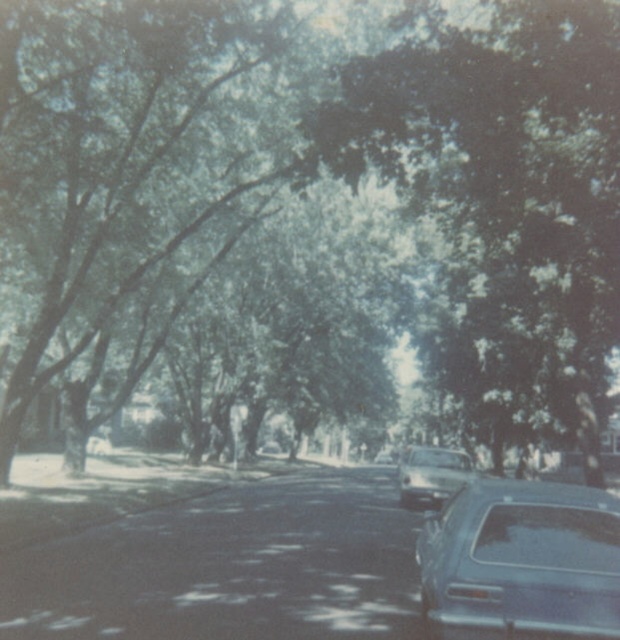
You are standing at the center of the street and want to find the shiny blue sedan at lower right. According to the coordinates provided, in which direction should you look to locate it?

The shiny blue sedan at lower right is located at point 0.880 on the x axis and 0.842 on the y axis. Since the coordinates are both above 0.5, you should look towards the lower right direction to find it.

You are a delivery person trying to navigate through the street. The green leafy tree at center and the shiny silver car at center are both in your path. Which one is wider, making it harder to pass between them?

The green leafy tree at center is wider than the shiny silver car at center, so it would be harder to pass between them.

You are a delivery person needing to park your car, which is 15 feet long, between the green leafy tree at center and the shiny silver car at center. Is there enough space?

The distance between the green leafy tree at center and the shiny silver car at center is 20.39 feet, which is more than enough to accommodate your 15 feet long car.